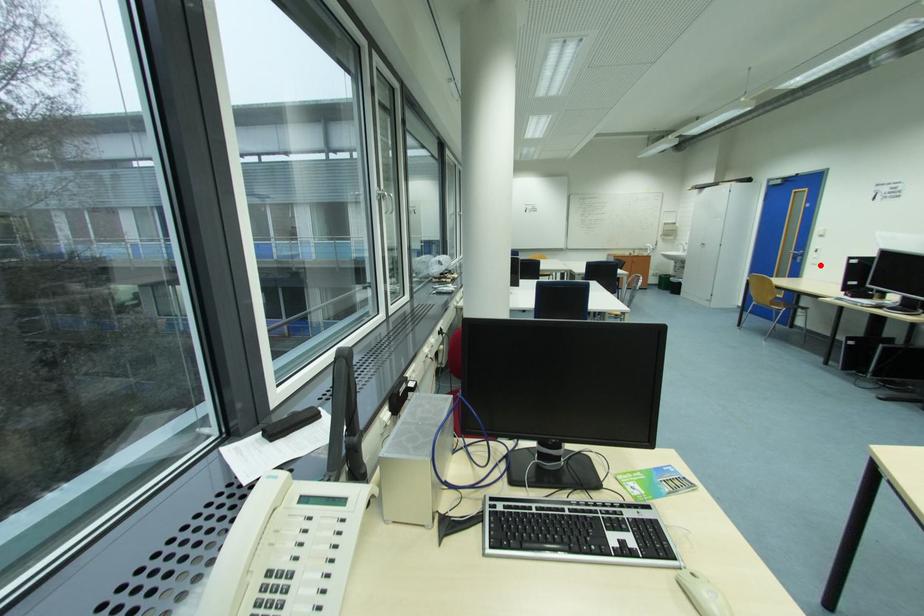
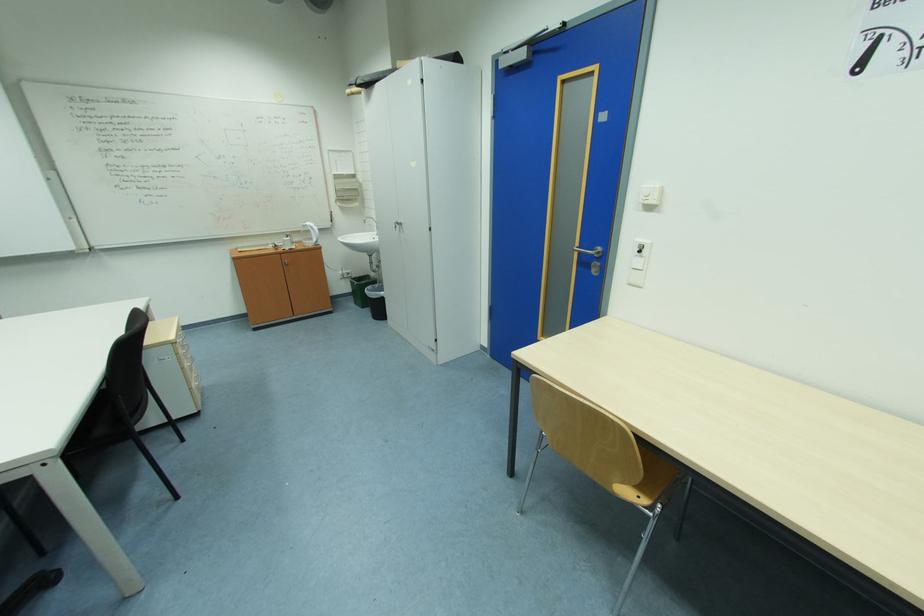
Question: I am providing you with two images of the same scene from different viewpoints. A red point is marked on the first image. At the location where the point appears in image 1, is it still visible in image 2?

Choices:
 (A) Yes
 (B) No

Answer: (A)